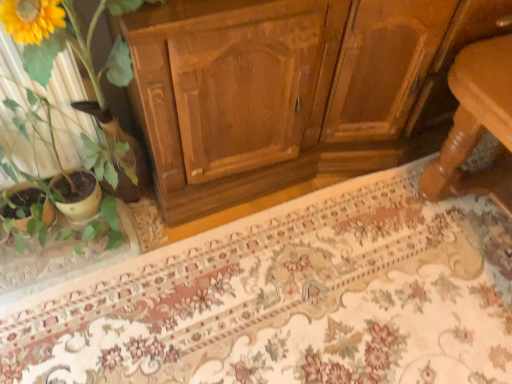
Question: In terms of size, does floral carpet at center appear bigger or smaller than matte yellow pot at left?

Choices:
 (A) small
 (B) big

Answer: (A)

Question: Is floral carpet at center inside or outside of matte yellow pot at left?

Choices:
 (A) outside
 (B) inside

Answer: (A)

Question: From the image's perspective, is floral carpet at center positioned above or below matte yellow pot at left?

Choices:
 (A) below
 (B) above

Answer: (A)

Question: From the image's perspective, relative to floral carpet at center, is matte yellow pot at left above or below?

Choices:
 (A) above
 (B) below

Answer: (A)

Question: Considering the positions of matte yellow pot at left and floral carpet at center in the image, is matte yellow pot at left wider or thinner than floral carpet at center?

Choices:
 (A) thin
 (B) wide

Answer: (A)

Question: From a real-world perspective, is matte yellow pot at left physically located above or below floral carpet at center?

Choices:
 (A) above
 (B) below

Answer: (A)

Question: Considering the relative positions of matte yellow pot at left and floral carpet at center in the image provided, is matte yellow pot at left to the left or to the right of floral carpet at center?

Choices:
 (A) left
 (B) right

Answer: (A)